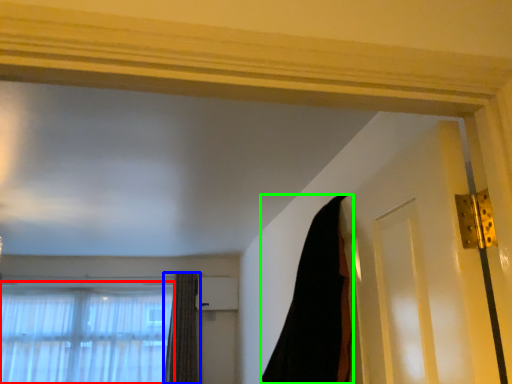
Question: Considering the real-world distances, which object is closest to window (highlighted by a red box)? curtain (highlighted by a blue box) or curtain (highlighted by a green box).

Choices:
 (A) curtain
 (B) curtain

Answer: (A)